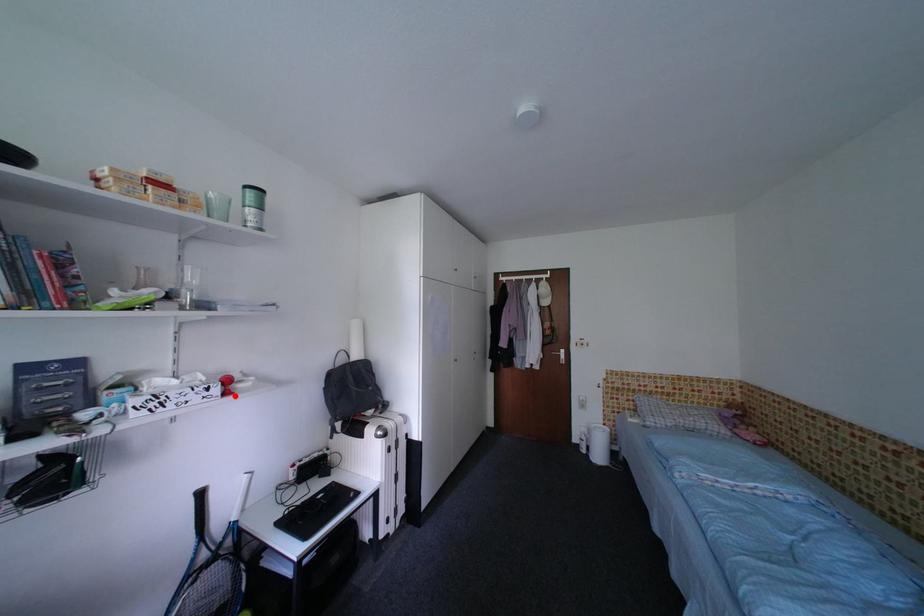
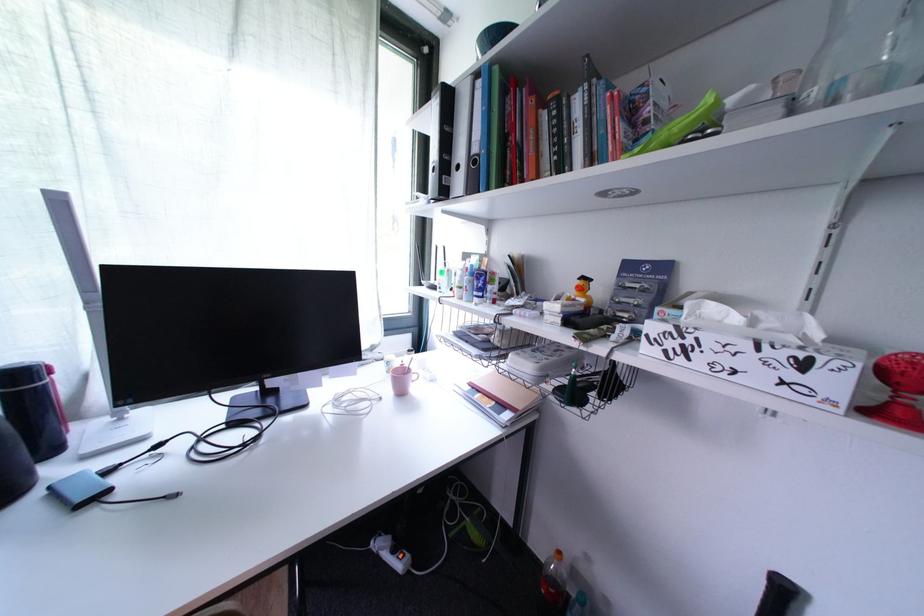
Where in the second image is the point corresponding to the highlighted location from the first image?

(897, 416)